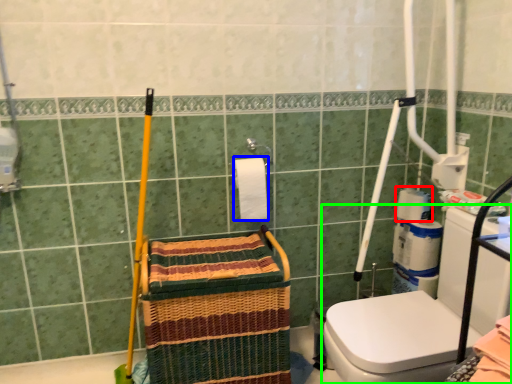
Question: Estimate the real-world distances between objects in this image. Which object is farther from toilet paper (highlighted by a red box), toilet paper (highlighted by a blue box) or washer (highlighted by a green box)?

Choices:
 (A) toilet paper
 (B) washer

Answer: (A)